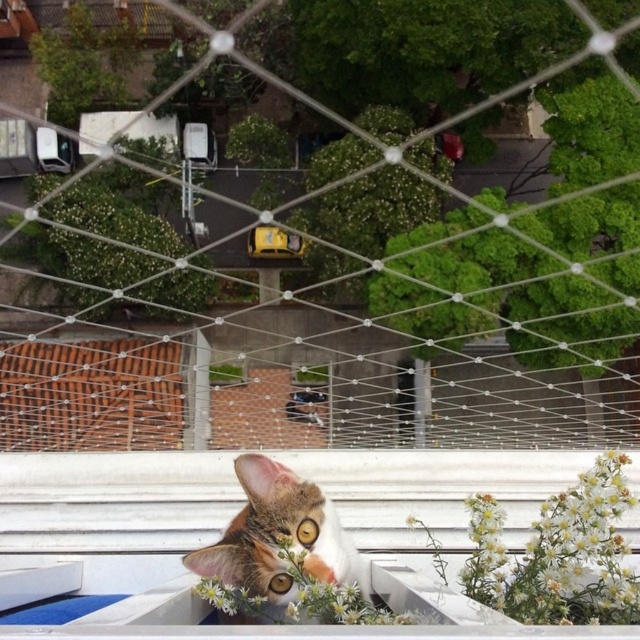
From the picture: You are trying to determine if the tabby fur cat at center can fit through the white mesh netting at center. Based on the netting width and the cat size, can the cat pass through?

The white mesh netting at center might be wider than tabby fur cat at center, so there is a possibility that the cat can pass through if the netting width allows.

You are a photographer trying to capture the tabby fur cat at center through the white mesh netting at center. Will the cat be visible through the netting?

The tabby fur cat at center is behind the white mesh netting at center, so the cat will be visible through the netting as the netting is a transparent material.